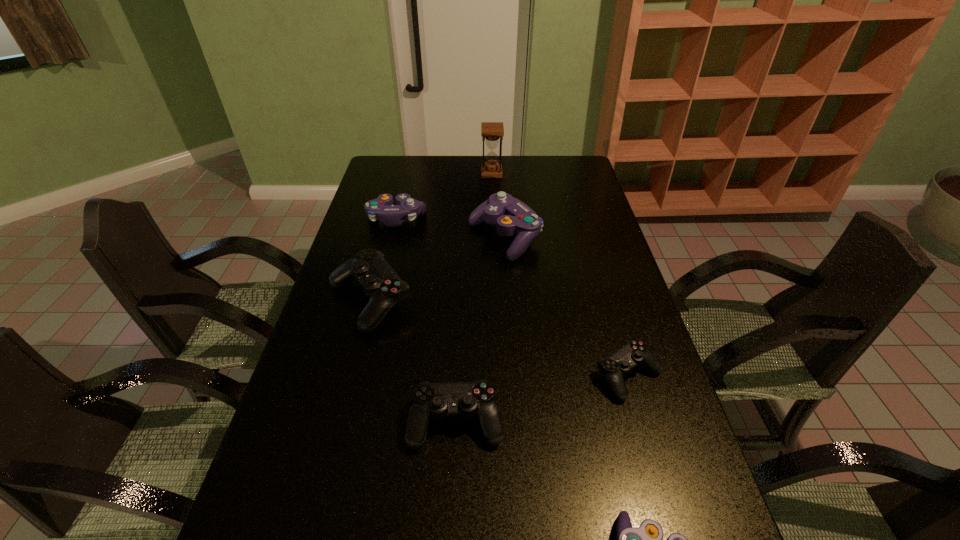
The image size is (960, 540). Identify the location of vacant space in between the biggest purple control and the leftmost purple control. (450, 229).

You are a GUI agent. You are given a task and a screenshot of the screen. Output one action in this format:
    pyautogui.click(x=<x>, y=<y>)
    Task: Click on the free space between the leftmost black control and the second black control from left to right
    The image size is (960, 540).
    Given the screenshot: What is the action you would take?
    pyautogui.click(x=413, y=362)

At what (x,y) coordinates should I click in order to perform the action: click on free space between the biggest purple control and the smallest black control. Please return your answer as a coordinate pair (x, y). Looking at the image, I should click on (566, 307).

The height and width of the screenshot is (540, 960). Find the location of `object that is the second closest one to the hourglass`. object that is the second closest one to the hourglass is located at coordinates (382, 208).

Find the location of a particular element. object that is the sixth nearest to the second black control from left to right is located at coordinates pyautogui.click(x=491, y=131).

Locate an element on the screen. control that is the third nearest to the second purple control from right to left is located at coordinates (633, 353).

Identify which control is located as the fifth nearest to the second black control from right to left. Please provide its 2D coordinates. Your answer should be formatted as a tuple, i.e. [(x, y)], where the tuple contains the x and y coordinates of a point satisfying the conditions above.

[(382, 208)]

Identify the location of purple control that stands as the second closest to the nearest purple control. (382, 208).

At what (x,y) coordinates should I click in order to perform the action: click on purple control that is the closest to the nearest purple control. Please return your answer as a coordinate pair (x, y). Looking at the image, I should click on (512, 217).

Where is `black control that is the closest to the smallest purple control`? The width and height of the screenshot is (960, 540). black control that is the closest to the smallest purple control is located at coordinates (x=477, y=398).